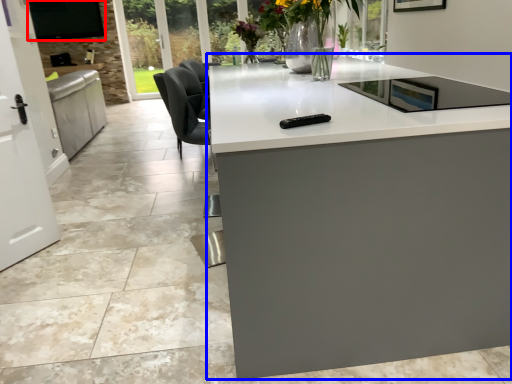
Question: Which of the following is the closest to the observer, window screen (highlighted by a red box) or countertop (highlighted by a blue box)?

Choices:
 (A) window screen
 (B) countertop

Answer: (B)